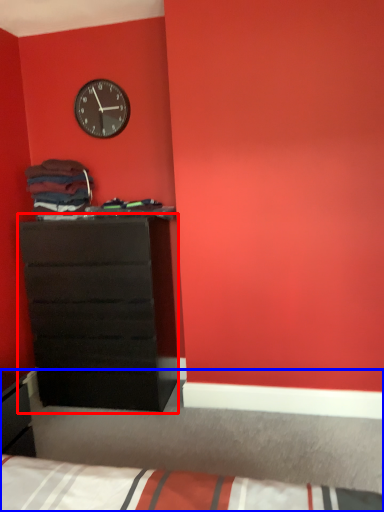
Question: Which object is closer to the camera taking this photo, chest of drawers (highlighted by a red box) or bed (highlighted by a blue box)?

Choices:
 (A) chest of drawers
 (B) bed

Answer: (B)